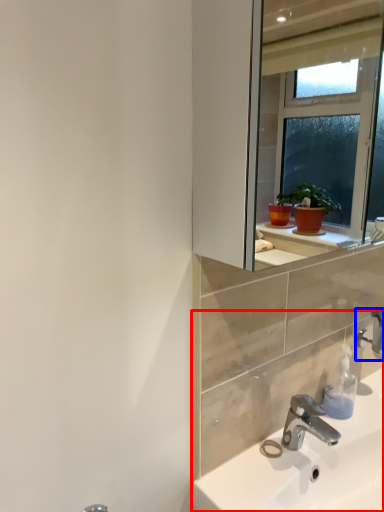
Question: Which of the following is the closest to the observer, sink (highlighted by a red box) or tap (highlighted by a blue box)?

Choices:
 (A) sink
 (B) tap

Answer: (A)